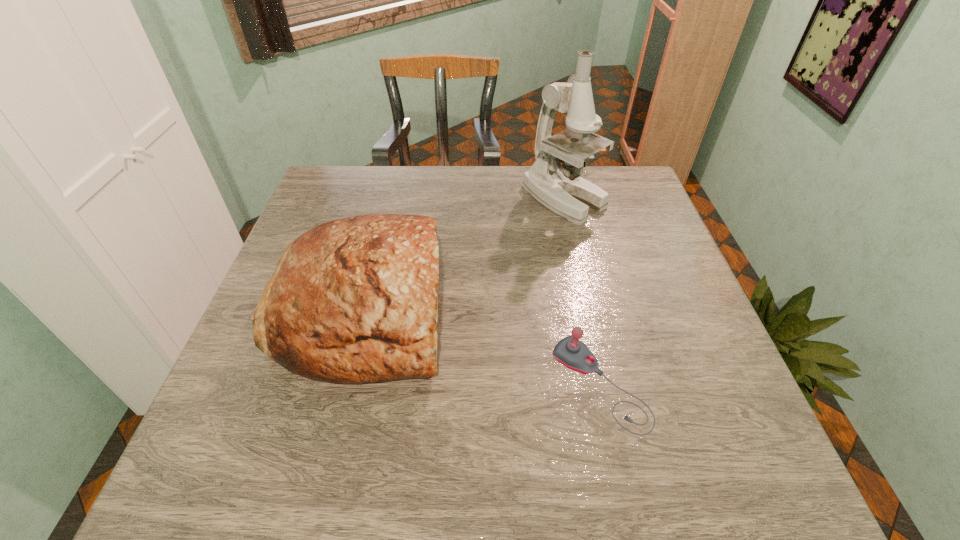
In order to click on object that ranks as the closest to the leftmost object in this screenshot , I will do `click(560, 188)`.

Identify which object is the nearest to the second shortest object. Please provide its 2D coordinates. Your answer should be formatted as a tuple, i.e. [(x, y)], where the tuple contains the x and y coordinates of a point satisfying the conditions above.

[(560, 188)]

Image resolution: width=960 pixels, height=540 pixels. What are the coordinates of `vacant space that satisfies the following two spatial constraints: 1. at the sliced front of the second tallest object; 2. on the left side of the shortest object` in the screenshot? It's located at (343, 384).

The height and width of the screenshot is (540, 960). I want to click on free space that satisfies the following two spatial constraints: 1. on the front side of the tallest object; 2. at the sliced front of the bread, so click(x=589, y=308).

The height and width of the screenshot is (540, 960). I want to click on blank area in the image that satisfies the following two spatial constraints: 1. at the sliced front of the joystick; 2. on the right side of the leftmost object, so click(x=343, y=384).

I want to click on free location that satisfies the following two spatial constraints: 1. at the sliced front of the second tallest object; 2. on the left side of the shortest object, so click(x=343, y=384).

Locate an element on the screen. This screenshot has width=960, height=540. free space that satisfies the following two spatial constraints: 1. at the sliced front of the leftmost object; 2. on the right side of the joystick is located at coordinates (343, 384).

You are a GUI agent. You are given a task and a screenshot of the screen. Output one action in this format:
    pyautogui.click(x=<x>, y=<y>)
    Task: Click on the vacant area that satisfies the following two spatial constraints: 1. on the back side of the shortest object; 2. at the sliced front of the leftmost object
    Image resolution: width=960 pixels, height=540 pixels.
    Given the screenshot: What is the action you would take?
    pyautogui.click(x=583, y=308)